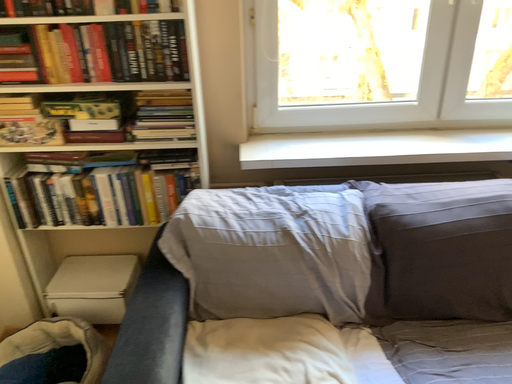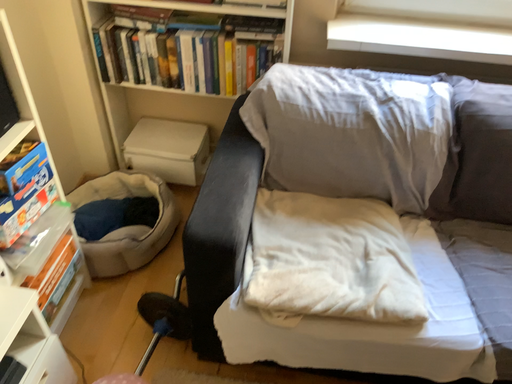
Question: Which way did the camera rotate in the video?

Choices:
 (A) rotated downward
 (B) rotated upward

Answer: (A)